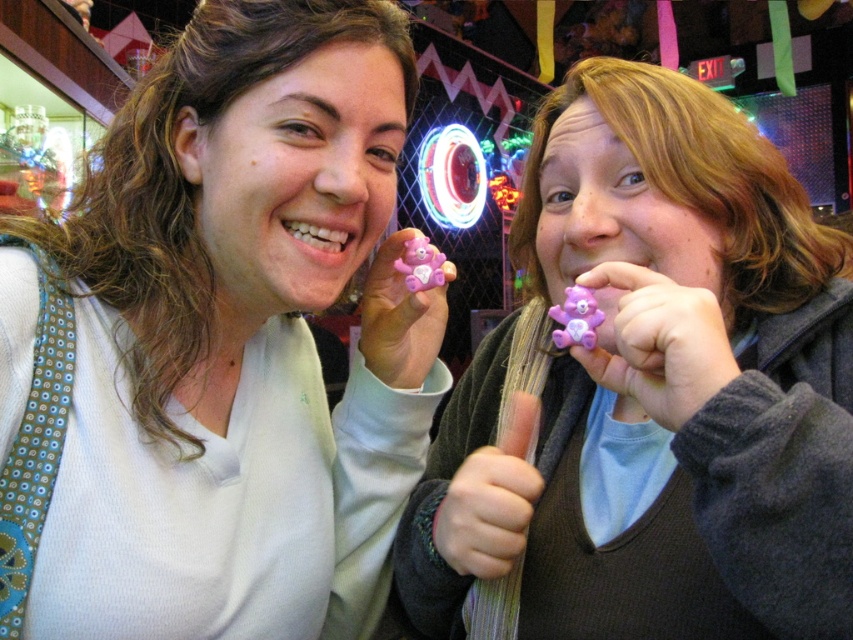
Question: Does pink matte bear at center appear over pink plastic bear at center?

Choices:
 (A) no
 (B) yes

Answer: (B)

Question: Among these points, which one is farthest from the camera?

Choices:
 (A) (556, 180)
 (B) (187, 417)

Answer: (A)

Question: Considering the relative positions of pink matte bear at center and pink plastic bear at center in the image provided, where is pink matte bear at center located with respect to pink plastic bear at center?

Choices:
 (A) below
 (B) above

Answer: (B)

Question: Which point is closer to the camera taking this photo?

Choices:
 (A) (727, 380)
 (B) (345, 456)

Answer: (A)

Question: Which point is closer to the camera?

Choices:
 (A) (701, 554)
 (B) (195, 452)

Answer: (A)

Question: Can you confirm if pink matte bear at center is positioned below pink plastic bear at center?

Choices:
 (A) no
 (B) yes

Answer: (A)